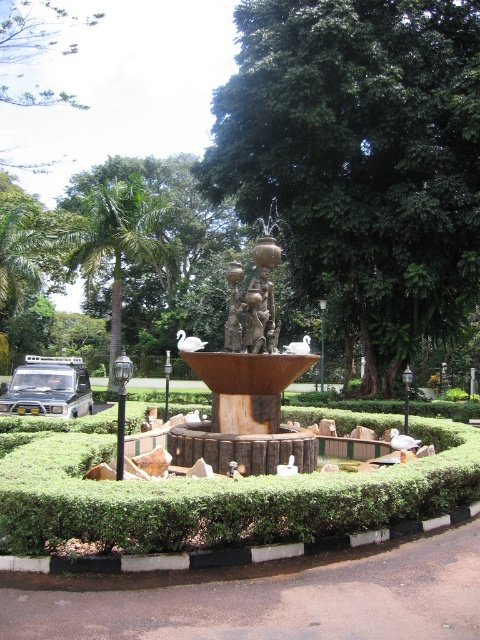
Which is behind, point (455, 429) or point (186, 436)?

The point (455, 429) is behind.

You are a GUI agent. You are given a task and a screenshot of the screen. Output one action in this format:
    pyautogui.click(x=<x>, y=<y>)
    Task: Click on the green leafy hedge at center
    This screenshot has width=480, height=640.
    Given the screenshot: What is the action you would take?
    pyautogui.click(x=218, y=497)

In the scene shown: Which is more to the right, green leafy tree at left or bronze statue at center?

From the viewer's perspective, bronze statue at center appears more on the right side.

Is point (117, 320) more distant than point (230, 285)?

Yes.

Find the location of a particular element. The width and height of the screenshot is (480, 640). green leafy tree at left is located at coordinates (120, 241).

Is green leafy hedge at center to the left of bronze statue at center from the viewer's perspective?

In fact, green leafy hedge at center is to the right of bronze statue at center.

Between point (69, 524) and point (230, 280), which one is positioned in front?

Point (69, 524) is in front.

Is point (1, 470) in front of point (227, 326)?

Yes, it is in front of point (227, 326).

Image resolution: width=480 pixels, height=640 pixels. In order to click on green leafy hedge at center in this screenshot , I will do `click(218, 497)`.